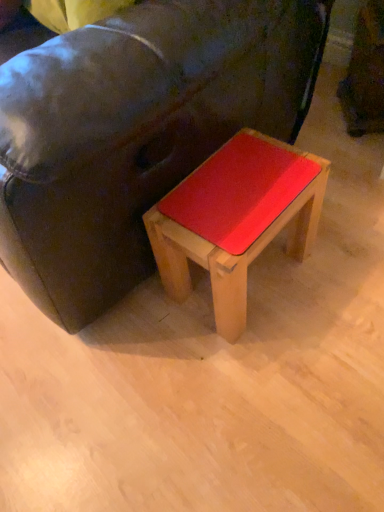
Question: Looking at the image, does matte wood stool at center seem bigger or smaller compared to matte black couch at center?

Choices:
 (A) big
 (B) small

Answer: (B)

Question: Is matte wood stool at center spatially inside matte black couch at center, or outside of it?

Choices:
 (A) outside
 (B) inside

Answer: (B)

Question: Looking at their shapes, would you say matte wood stool at center is wider or thinner than matte black couch at center?

Choices:
 (A) wide
 (B) thin

Answer: (B)

Question: Looking at the image, does matte black couch at center seem bigger or smaller compared to matte wood stool at center?

Choices:
 (A) small
 (B) big

Answer: (B)

Question: Is matte black couch at center taller or shorter than matte wood stool at center?

Choices:
 (A) short
 (B) tall

Answer: (B)

Question: Visually, is matte black couch at center positioned to the left or to the right of matte wood stool at center?

Choices:
 (A) right
 (B) left

Answer: (B)

Question: Considering the positions of point (211, 110) and point (195, 207), is point (211, 110) closer or farther from the camera than point (195, 207)?

Choices:
 (A) closer
 (B) farther

Answer: (A)